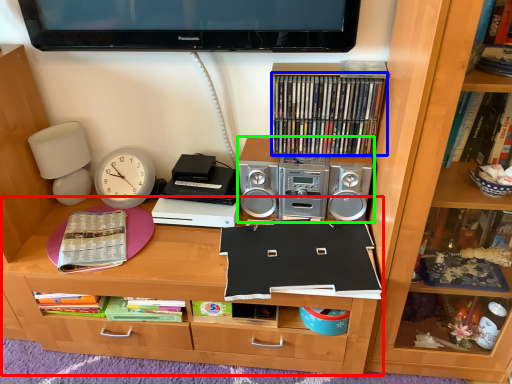
Question: Estimate the real-world distances between objects in this image. Which object is closer to desk (highlighted by a red box), book (highlighted by a blue box) or stereo (highlighted by a green box)?

Choices:
 (A) book
 (B) stereo

Answer: (B)